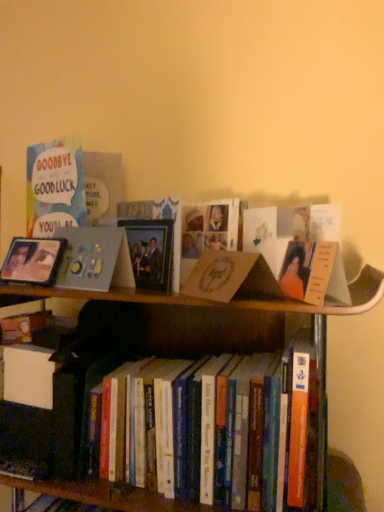
Question: Would you say matte silver picture frame at left is outside hardcover books at center?

Choices:
 (A) no
 (B) yes

Answer: (B)

Question: From a real-world perspective, does matte silver picture frame at left stand above hardcover books at center?

Choices:
 (A) no
 (B) yes

Answer: (B)

Question: Is matte silver picture frame at left oriented towards hardcover books at center?

Choices:
 (A) yes
 (B) no

Answer: (B)

Question: Can you confirm if matte silver picture frame at left is thinner than hardcover books at center?

Choices:
 (A) no
 (B) yes

Answer: (B)

Question: From the image's perspective, does matte silver picture frame at left appear lower than hardcover books at center?

Choices:
 (A) no
 (B) yes

Answer: (A)

Question: Is matte silver picture frame at left touching hardcover books at center?

Choices:
 (A) no
 (B) yes

Answer: (A)

Question: Considering the relative sizes of brown cardboard book at center and matte gray photo frame at upper left in the image provided, is brown cardboard book at center shorter than matte gray photo frame at upper left?

Choices:
 (A) yes
 (B) no

Answer: (A)

Question: From the image's perspective, would you say brown cardboard book at center is shown under matte gray photo frame at upper left?

Choices:
 (A) yes
 (B) no

Answer: (A)

Question: Considering the relative sizes of brown cardboard book at center and matte gray photo frame at upper left in the image provided, is brown cardboard book at center taller than matte gray photo frame at upper left?

Choices:
 (A) yes
 (B) no

Answer: (B)

Question: Is brown cardboard book at center with matte gray photo frame at upper left?

Choices:
 (A) no
 (B) yes

Answer: (A)

Question: From a real-world perspective, is brown cardboard book at center located higher than matte gray photo frame at upper left?

Choices:
 (A) no
 (B) yes

Answer: (A)

Question: Is brown cardboard book at center turned away from matte gray photo frame at upper left?

Choices:
 (A) yes
 (B) no

Answer: (B)

Question: Does brown cardboard book at center have a smaller size compared to matte silver picture frame at left?

Choices:
 (A) yes
 (B) no

Answer: (B)